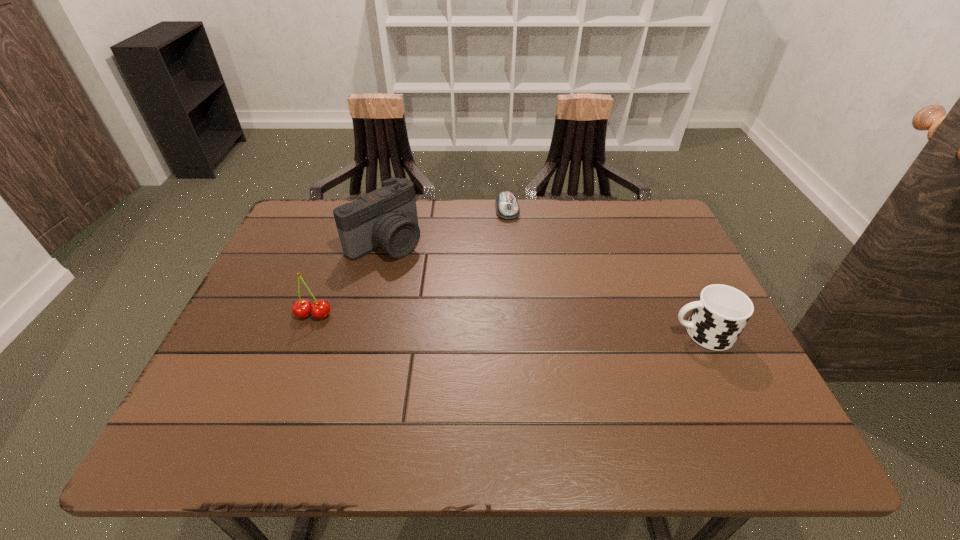
Identify the location of free space located 0.270m at the lens of the camera. (478, 310).

At what (x,y) coordinates should I click in order to perform the action: click on free location located at the lens of the camera. Please return your answer as a coordinate pair (x, y). The width and height of the screenshot is (960, 540). Looking at the image, I should click on (492, 321).

Locate an element on the screen. Image resolution: width=960 pixels, height=540 pixels. vacant area situated on the wheel side of the computer mouse is located at coordinates (515, 244).

What are the coordinates of `vacant area located 0.390m on the wheel side of the computer mouse` in the screenshot? It's located at (533, 317).

At what (x,y) coordinates should I click in order to perform the action: click on vacant space located on the wheel side of the computer mouse. Please return your answer as a coordinate pair (x, y). This screenshot has width=960, height=540. Looking at the image, I should click on (528, 299).

You are a GUI agent. You are given a task and a screenshot of the screen. Output one action in this format:
    pyautogui.click(x=<x>, y=<y>)
    Task: Click on the camera that is at the far edge
    This screenshot has width=960, height=540.
    Given the screenshot: What is the action you would take?
    pyautogui.click(x=387, y=217)

The image size is (960, 540). Find the location of `computer mouse that is at the far edge`. computer mouse that is at the far edge is located at coordinates (507, 207).

Identify the location of object present at the left edge. This screenshot has height=540, width=960. (320, 309).

Locate an element on the screen. object that is positioned at the right edge is located at coordinates (721, 312).

Find the location of a particular element. The image size is (960, 540). vacant space at the far edge of the desktop is located at coordinates (496, 215).